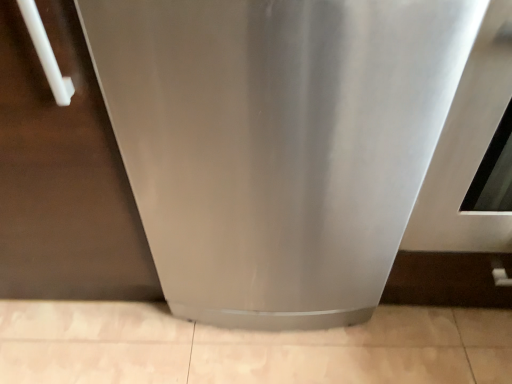
Question: From the image's perspective, is satin silver refrigerator at lower left located above or below stainless steel refrigerator at center?

Choices:
 (A) below
 (B) above

Answer: (A)

Question: Considering the positions of point (13, 1) and point (183, 301), is point (13, 1) closer or farther from the camera than point (183, 301)?

Choices:
 (A) farther
 (B) closer

Answer: (B)

Question: Looking at their shapes, would you say satin silver refrigerator at lower left is wider or thinner than stainless steel refrigerator at center?

Choices:
 (A) thin
 (B) wide

Answer: (A)

Question: In terms of height, does stainless steel refrigerator at center look taller or shorter compared to satin silver refrigerator at lower left?

Choices:
 (A) tall
 (B) short

Answer: (A)

Question: Is stainless steel refrigerator at center inside or outside of satin silver refrigerator at lower left?

Choices:
 (A) outside
 (B) inside

Answer: (A)

Question: Is stainless steel refrigerator at center wider or thinner than satin silver refrigerator at lower left?

Choices:
 (A) wide
 (B) thin

Answer: (A)

Question: Relative to satin silver refrigerator at lower left, is stainless steel refrigerator at center in front or behind?

Choices:
 (A) front
 (B) behind

Answer: (A)